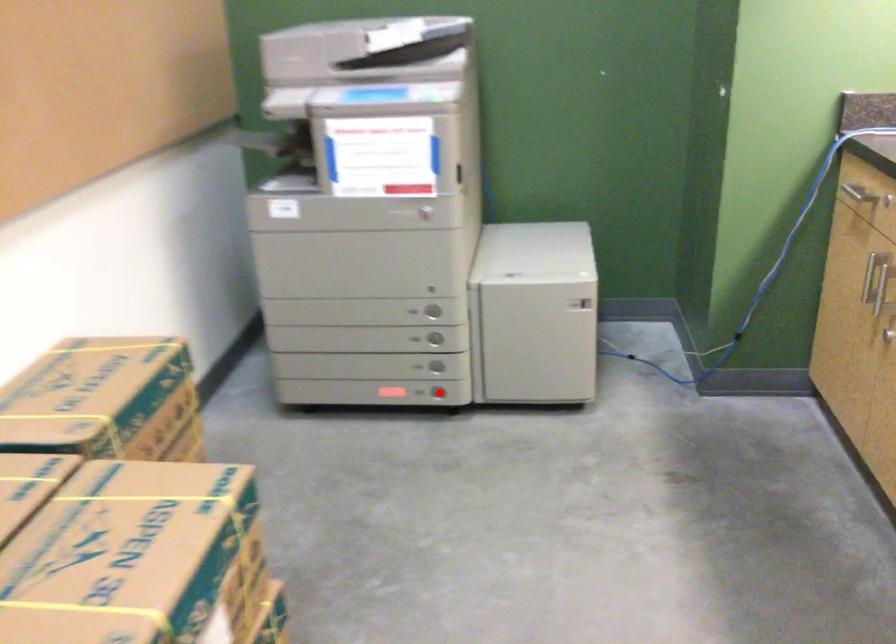
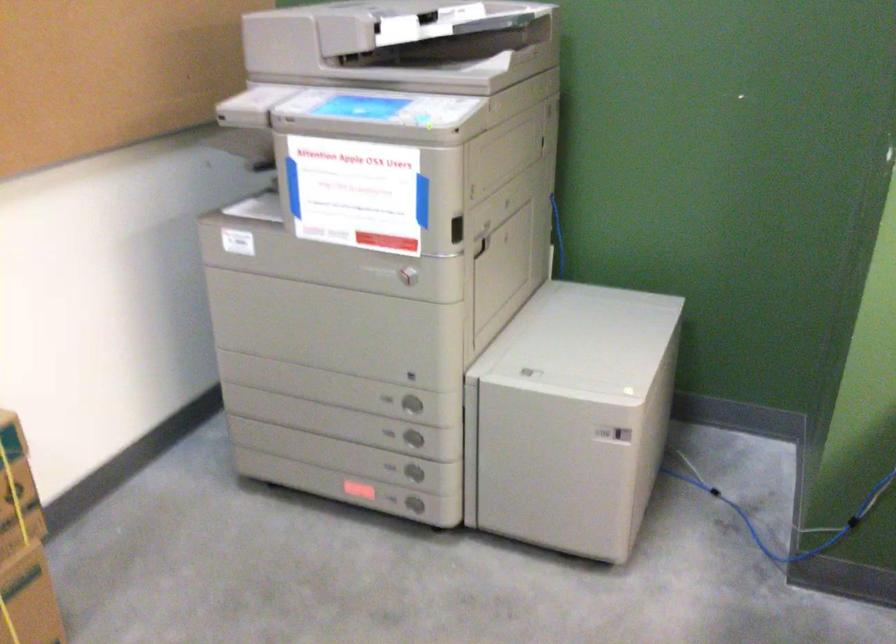
Question: I am providing you with two images of the same scene from different viewpoints. In image1, a red point is highlighted. Considering the same 3D point in image2, which of the following is correct?

Choices:
 (A) It is closer
 (B) It is farther

Answer: (A)